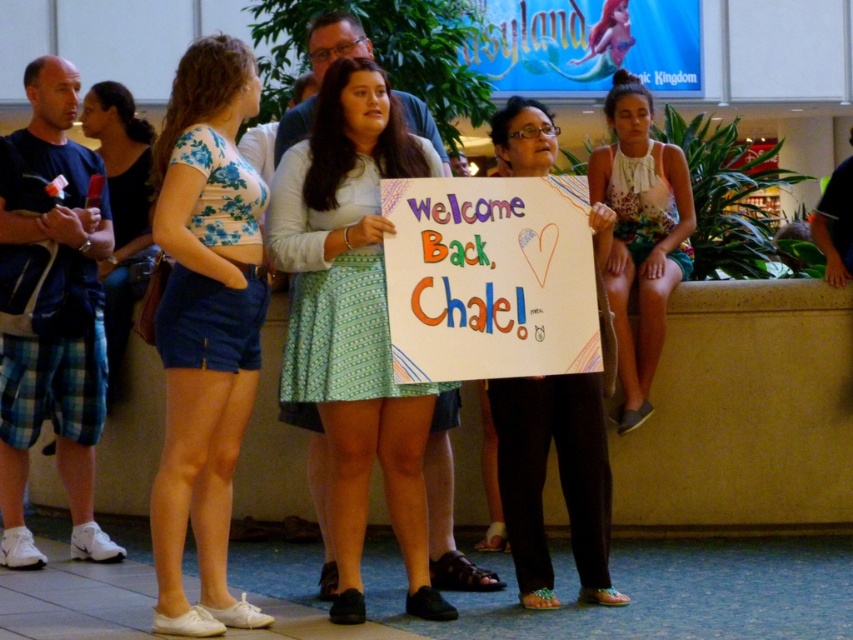
From the picture: You are a photographer trying to capture the blue floral crop top at center and the matte white sign at center in the same frame. Which object should you focus on first to ensure both are in the frame without moving the camera?

The blue floral crop top at center is taller than the matte white sign at center, so focus on the blue floral crop top at center first to ensure both are in the frame without moving the camera.

You are standing in the Asylum Kingdom area and want to take a photo of the point at coordinates [236,179]. If your camera has a maximum focus range of 6 meters, will it be able to focus on that point?

The point at coordinates [236,179] is 6.30 meters away from the viewer. Since the camera can only focus up to 6 meters, it won not be able to focus on that point.

You are a photographer positioned at the camera. You want to capture a closeup shot of the blue floral crop top at center. Given that the camera can focus on objects within 5 meters, will you be able to take the photo without moving closer?

The blue floral crop top at center is 5.92 meters from the camera, which is beyond the 5 meter focus range. Therefore, you cannot take the closeup shot without moving closer.